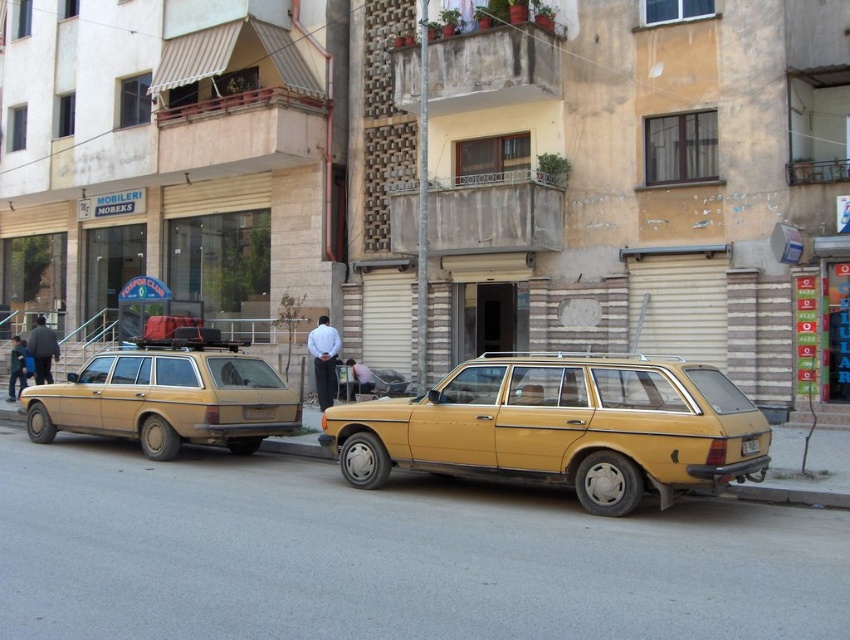
Question: Estimate the real-world distances between objects in this image. Which object is farther from the white matte shirt at center?

Choices:
 (A) yellow matte station wagon at center
 (B) dark gray pants at left

Answer: (A)

Question: Which point appears closest to the camera in this image?

Choices:
 (A) (48, 339)
 (B) (314, 376)
 (C) (225, 435)
 (D) (751, 449)

Answer: (D)

Question: Which point is farther from the camera taking this photo?

Choices:
 (A) tap(312, 342)
 (B) tap(20, 360)
 (C) tap(40, 342)

Answer: (B)

Question: Can you confirm if dark blue jeans at lower left is positioned to the right of yellow matte license plate at center?

Choices:
 (A) no
 (B) yes

Answer: (A)

Question: Can you confirm if matte yellow station wagon at left is wider than white shirt at center?

Choices:
 (A) yes
 (B) no

Answer: (A)

Question: Is white shirt at center above yellow matte license plate at center?

Choices:
 (A) no
 (B) yes

Answer: (B)